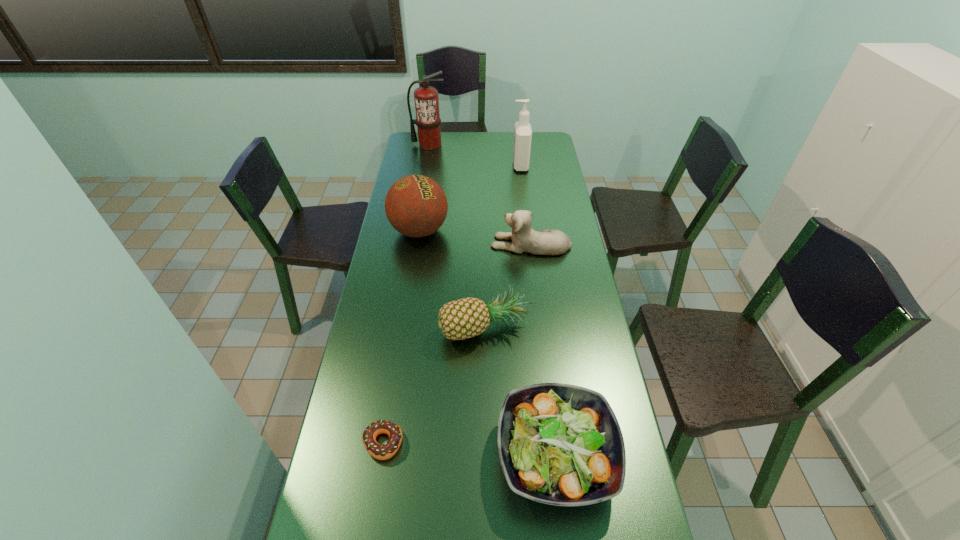
The image size is (960, 540). What are the coordinates of `free region at the far right corner of the desktop` in the screenshot? It's located at (532, 152).

Locate an element on the screen. This screenshot has height=540, width=960. free space between the basketball and the doughnut is located at coordinates (401, 337).

The height and width of the screenshot is (540, 960). Find the location of `free spot between the fifth farthest object and the puppy`. free spot between the fifth farthest object and the puppy is located at coordinates (508, 285).

Locate an element on the screen. This screenshot has height=540, width=960. vacant space in between the second farthest object and the farthest object is located at coordinates (474, 155).

Image resolution: width=960 pixels, height=540 pixels. I want to click on vacant point located between the pineapple and the farthest object, so click(x=457, y=235).

Where is `vacant area between the pineapple and the farthest object`? vacant area between the pineapple and the farthest object is located at coordinates (457, 235).

I want to click on free spot between the basketball and the shortest object, so click(401, 337).

Locate an element on the screen. This screenshot has height=540, width=960. unoccupied area between the pineapple and the fire extinguisher is located at coordinates (457, 235).

Identify the location of vacant area that lies between the fifth shortest object and the pineapple. The image size is (960, 540). (452, 279).

Locate which object is the second closest to the second farthest object. Please provide its 2D coordinates. Your answer should be formatted as a tuple, i.e. [(x, y)], where the tuple contains the x and y coordinates of a point satisfying the conditions above.

[(416, 206)]